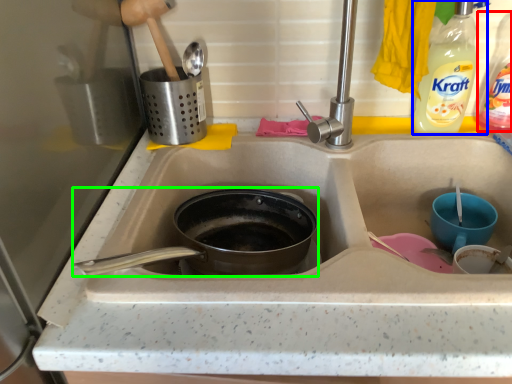
Question: Estimate the real-world distances between objects in this image. Which object is closer to bottle (highlighted by a red box), bottle (highlighted by a blue box) or frying pan (highlighted by a green box)?

Choices:
 (A) bottle
 (B) frying pan

Answer: (A)